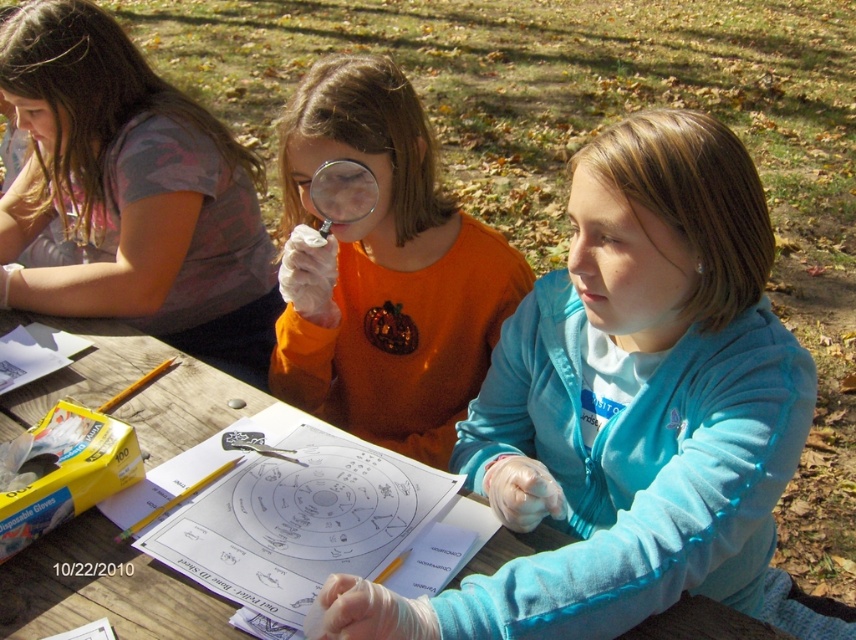
You are a photographer taking a picture of the orange sequined shirt at center and the transparent plastic magnifying glass at center. Which object will appear larger in the photo?

The orange sequined shirt at center will appear larger in the photo because it is much taller than the transparent plastic magnifying glass at center.

You are a photographer trying to capture a group photo of the individuals at the picnic table. You want to ensure that both the blue fleece jacket at center and the orange sequined shirt at center are clearly visible in the photo. Based on their positions, which one is closer to the camera and might require adjusting to ensure both are in focus?

The blue fleece jacket at center is positioned under the orange sequined shirt at center, meaning the orange sequined shirt at center is closer to the camera. To ensure both are in focus, you may need to adjust the camera settings or have the person in the blue fleece jacket move slightly forward.